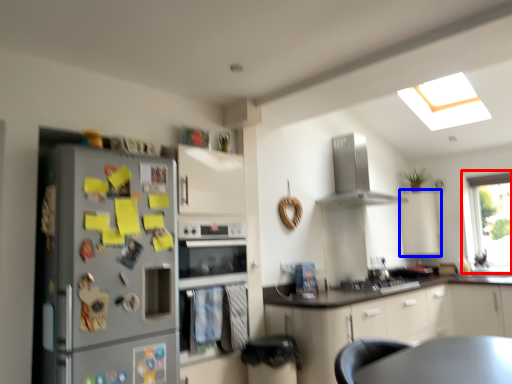
Question: Which object appears closest to the camera in this image, window (highlighted by a red box) or cabinetry (highlighted by a blue box)?

Choices:
 (A) window
 (B) cabinetry

Answer: (A)